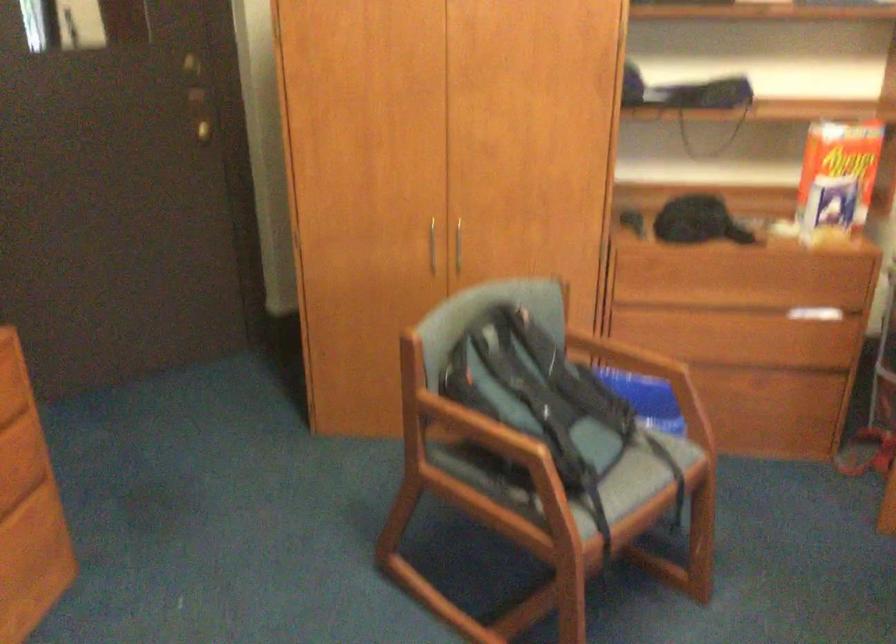
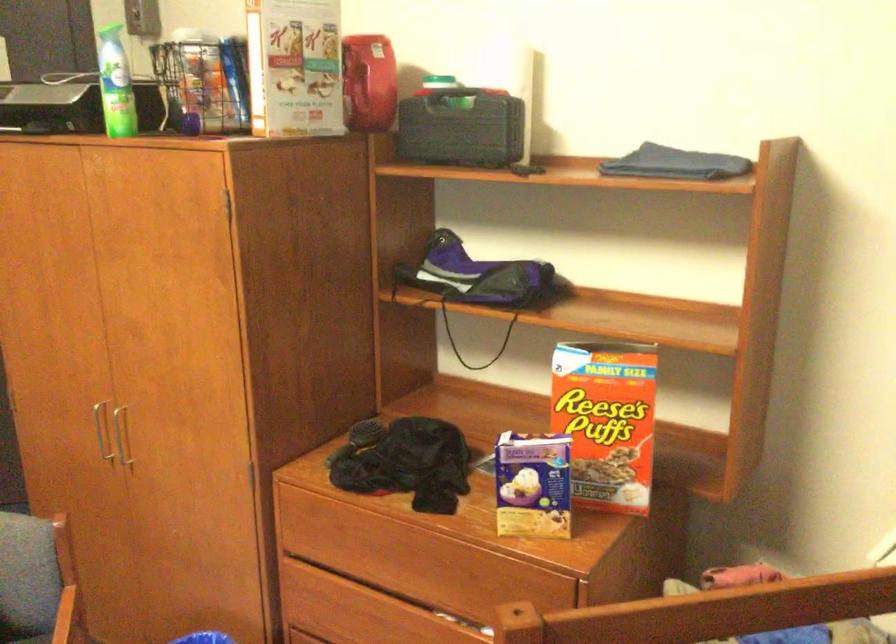
The images are taken continuously from a first-person perspective. In which direction are you moving?

The cameraman moved toward right, forward.